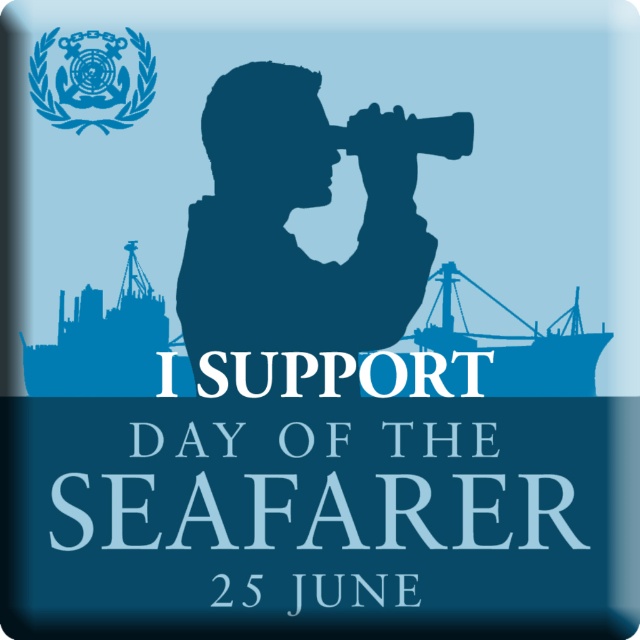
Can you confirm if matte blue silhouette at center is positioned below blue matte ship at lower left?

Actually, matte blue silhouette at center is above blue matte ship at lower left.

Is matte blue silhouette at center closer to camera compared to blue matte ship at lower left?

Yes, it is.

You are a GUI agent. You are given a task and a screenshot of the screen. Output one action in this format:
    pyautogui.click(x=<x>, y=<y>)
    Task: Click on the matte blue silhouette at center
    
    Given the screenshot: What is the action you would take?
    pyautogui.click(x=288, y=216)

Can you confirm if blue matte ship at center is positioned above blue glossy emblem at upper left?

Actually, blue matte ship at center is below blue glossy emblem at upper left.

Which is in front, point (547, 394) or point (100, 42)?

Point (547, 394)

Image resolution: width=640 pixels, height=640 pixels. I want to click on blue matte ship at center, so click(x=486, y=355).

Who is taller, blue matte ship at center or blue matte ship at lower left?

blue matte ship at lower left is taller.

Does blue matte ship at center appear on the right side of blue matte ship at lower left?

Indeed, blue matte ship at center is positioned on the right side of blue matte ship at lower left.

Which is behind, point (134, 392) or point (54, 355)?

Positioned behind is point (134, 392).

The height and width of the screenshot is (640, 640). I want to click on blue matte ship at center, so click(x=486, y=355).